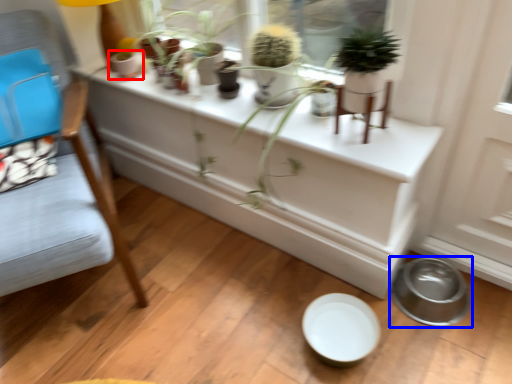
Question: Which of the following is the closest to the observer, flowerpot (highlighted by a red box) or bowl (highlighted by a blue box)?

Choices:
 (A) flowerpot
 (B) bowl

Answer: (B)